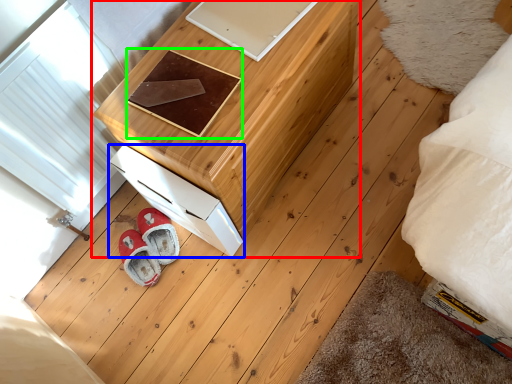
Question: Estimate the real-world distances between objects in this image. Which object is farther from furniture (highlighted by a red box), drawer (highlighted by a blue box) or pad (highlighted by a green box)?

Choices:
 (A) drawer
 (B) pad

Answer: (A)